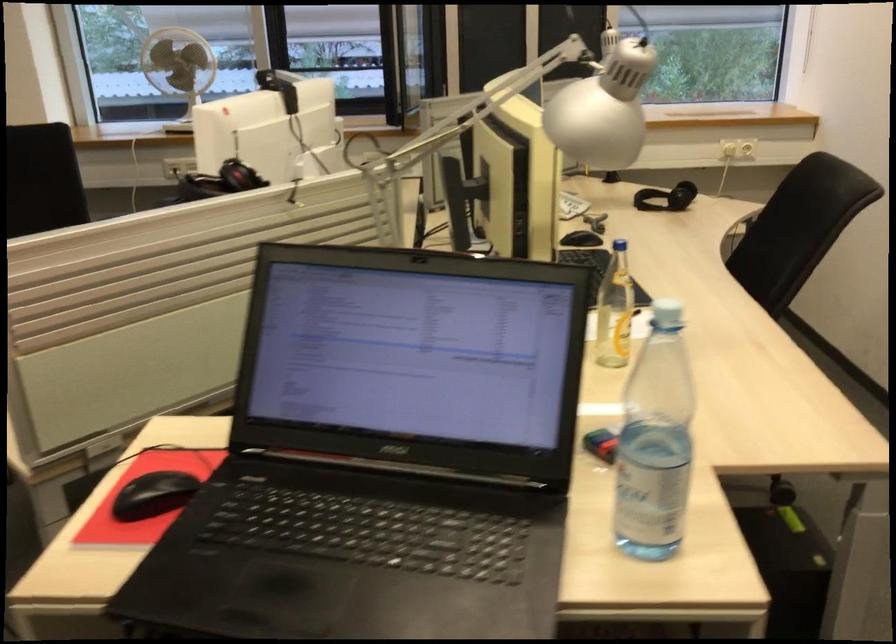
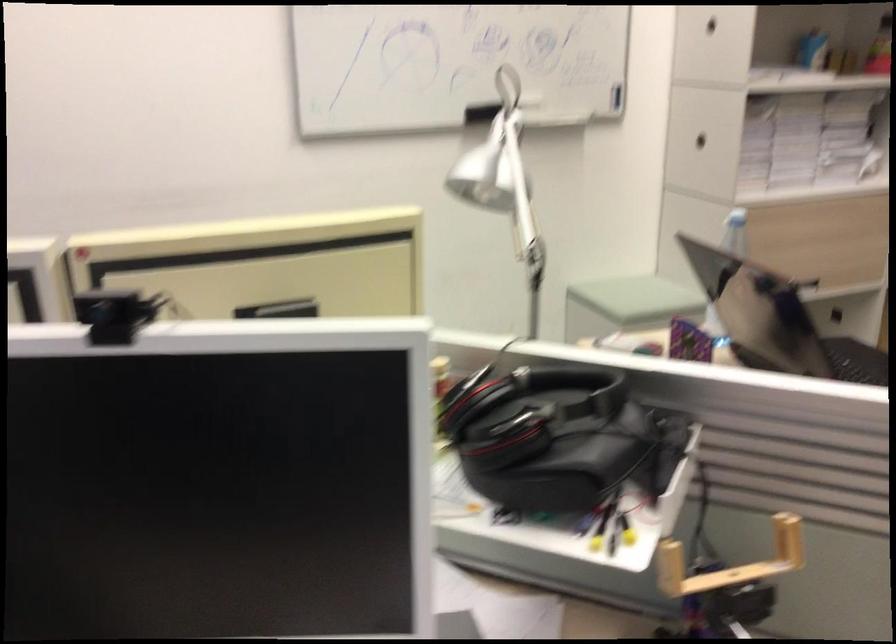
Where in the second image is the point corresponding to pixel 545 127 from the first image?

(504, 183)